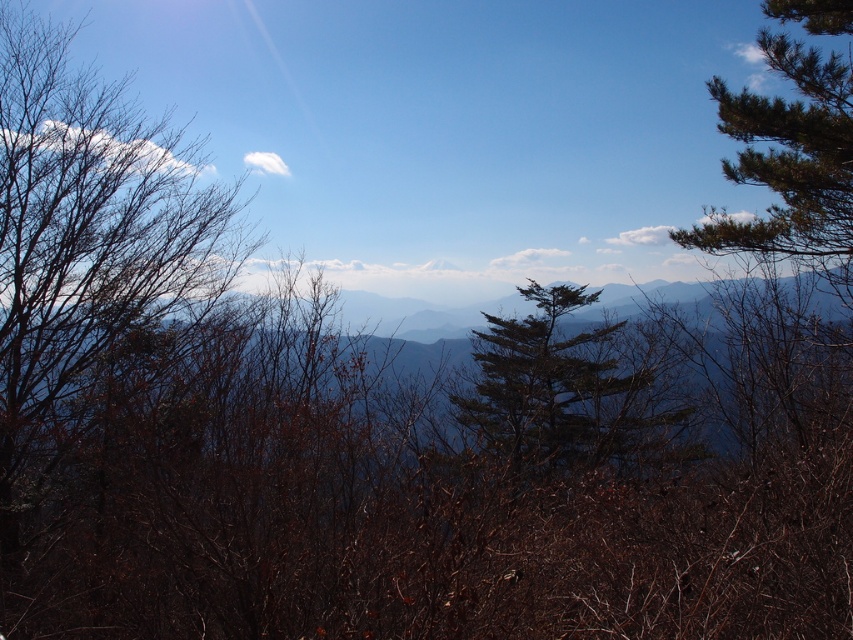
I want to click on green needle-like tree at upper right, so click(x=787, y=157).

Is green needle-like tree at upper right below green needle-like tree at center?

No, green needle-like tree at upper right is not below green needle-like tree at center.

Does point (817, 140) come closer to viewer compared to point (593, 394)?

Yes, it is.

At what (x,y) coordinates should I click in order to perform the action: click on green needle-like tree at upper right. Please return your answer as a coordinate pair (x, y). Looking at the image, I should click on (787, 157).